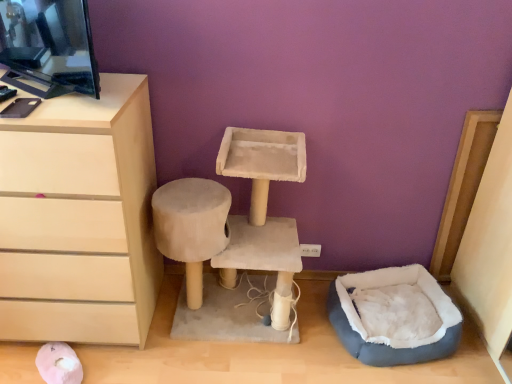
Question: From a real-world perspective, is gray plush bean bag at lower right positioned above or below matte beige chest of drawers at left?

Choices:
 (A) below
 (B) above

Answer: (A)

Question: Would you say gray plush bean bag at lower right is inside or outside matte beige chest of drawers at left?

Choices:
 (A) inside
 (B) outside

Answer: (B)

Question: Which object is positioned closest to the gray plush bean bag at lower right?

Choices:
 (A) beige suede cat tree at center
 (B) matte beige chest of drawers at left

Answer: (A)

Question: Which object is the closest to the matte beige chest of drawers at left?

Choices:
 (A) beige suede cat tree at center
 (B) gray plush bean bag at lower right

Answer: (A)